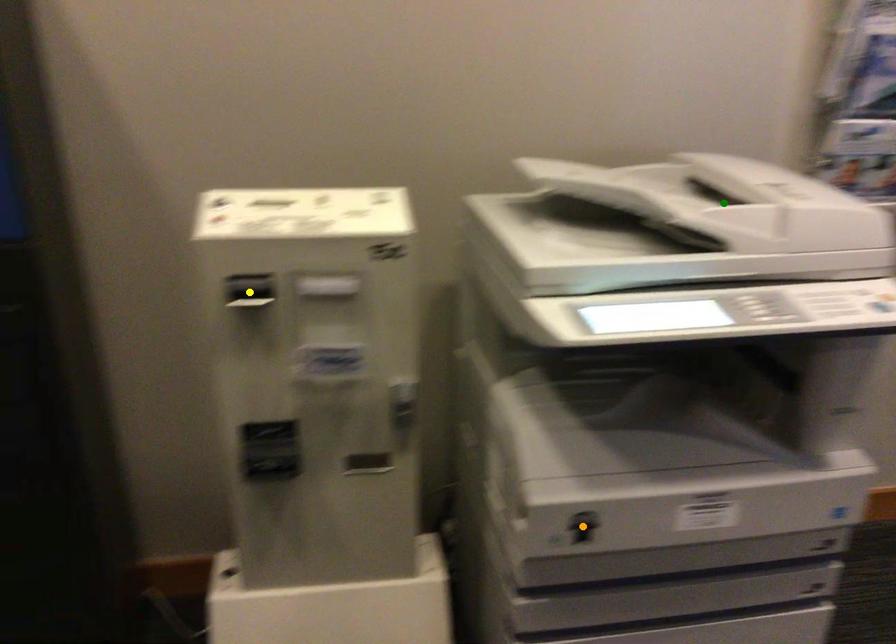
Order these from nearest to farthest:
yellow point
orange point
green point

1. yellow point
2. orange point
3. green point